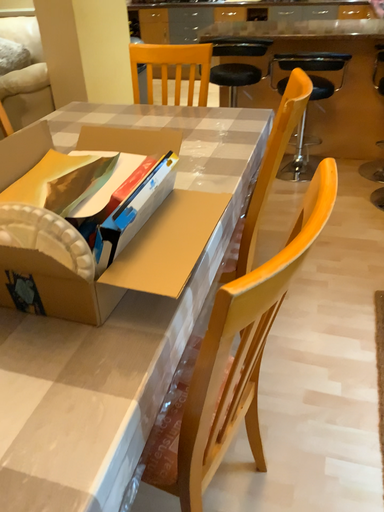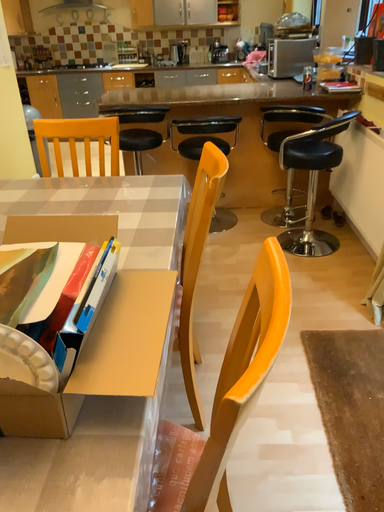
Question: Which way did the camera rotate in the video?

Choices:
 (A) rotated left
 (B) rotated right

Answer: (B)